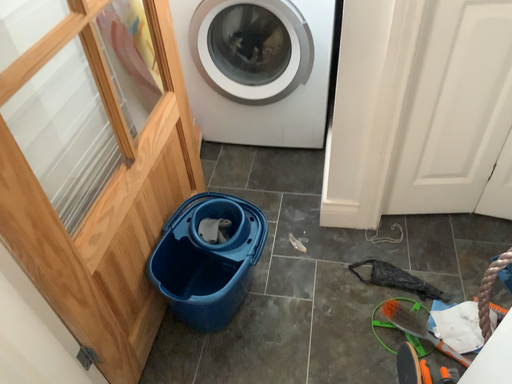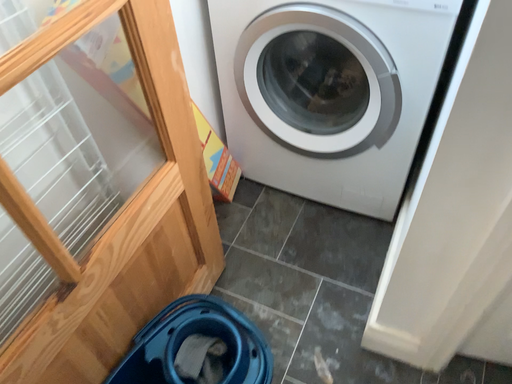
Question: How did the camera likely rotate when shooting the video?

Choices:
 (A) rotated right
 (B) rotated left

Answer: (B)